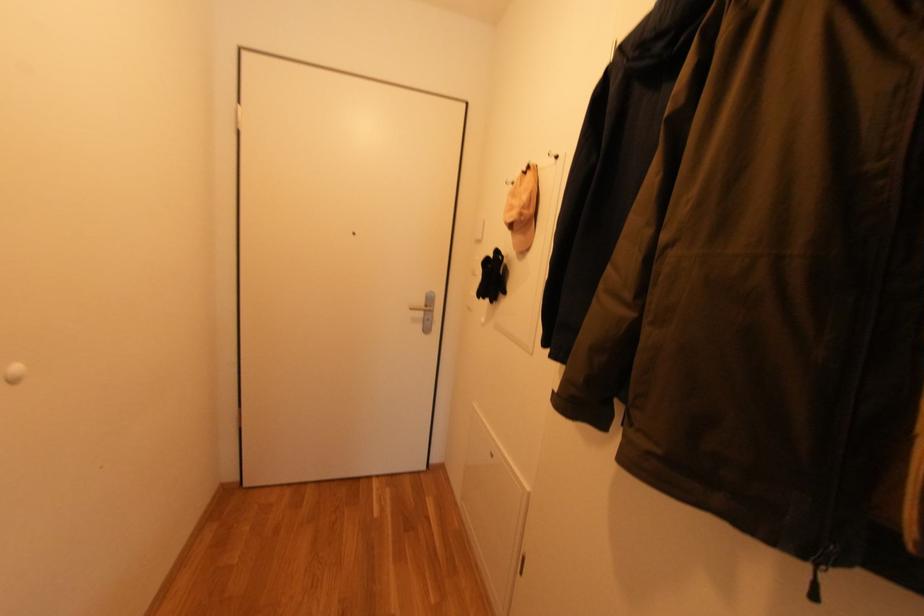
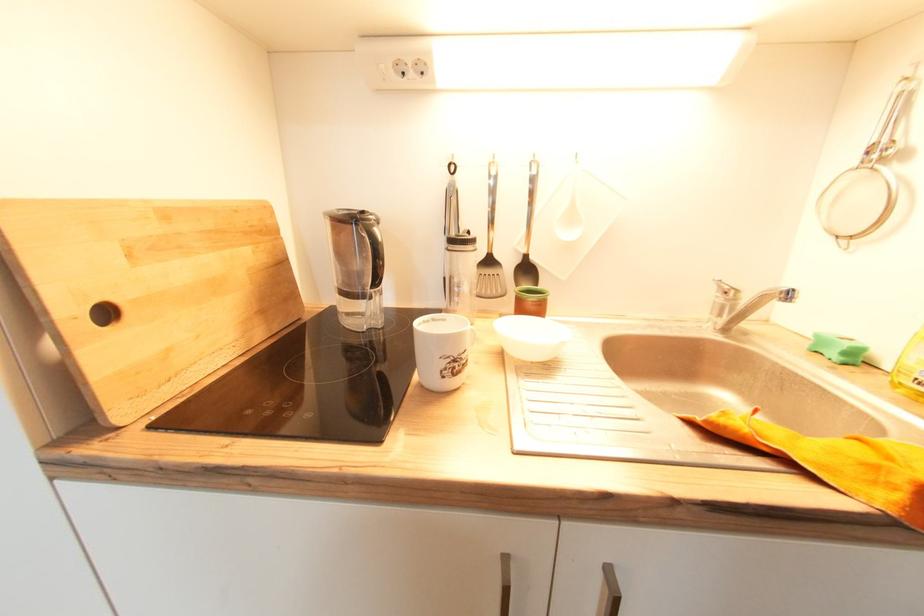
In a continuous first-person perspective shot, in which direction is the camera moving?

The cameraman moved toward right, backward.